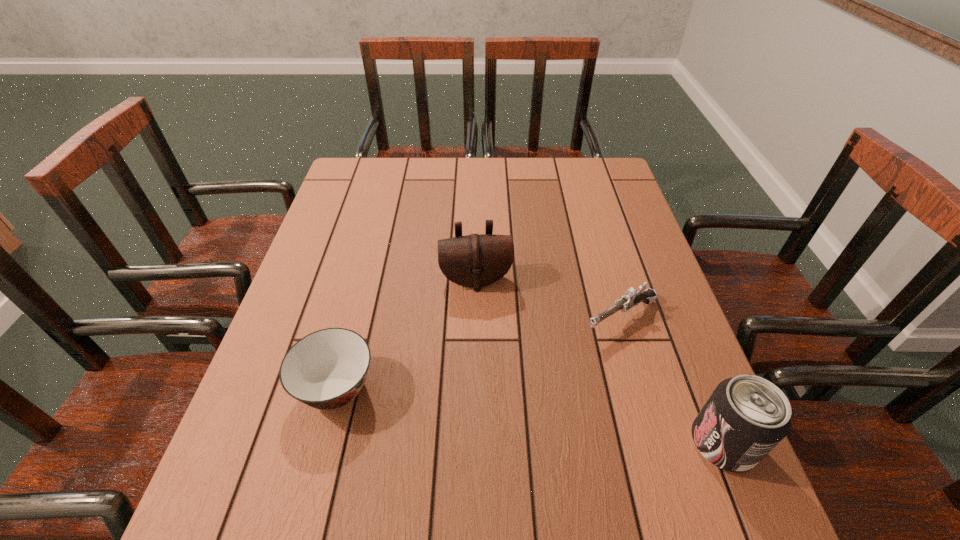
Find the location of a particular element. Image resolution: width=960 pixels, height=540 pixels. vacant space located aimed along the barrel of the gun is located at coordinates (485, 400).

This screenshot has width=960, height=540. What are the coordinates of `vacant region located aimed along the barrel of the gun` in the screenshot? It's located at (464, 414).

Find the location of a particular element. vacant region located aimed along the barrel of the gun is located at coordinates (509, 385).

The image size is (960, 540). In order to click on soup bowl present at the near edge in this screenshot , I will do `click(327, 369)`.

The width and height of the screenshot is (960, 540). In order to click on soda can that is at the near edge in this screenshot , I will do (746, 416).

Where is `object that is at the left edge`? object that is at the left edge is located at coordinates (327, 369).

Locate an element on the screen. The image size is (960, 540). soda can at the right edge is located at coordinates (746, 416).

The image size is (960, 540). In order to click on gun that is at the right edge in this screenshot , I will do pyautogui.click(x=632, y=297).

Image resolution: width=960 pixels, height=540 pixels. I want to click on object at the near left corner, so click(x=327, y=369).

Image resolution: width=960 pixels, height=540 pixels. In order to click on object that is at the near right corner in this screenshot , I will do `click(746, 416)`.